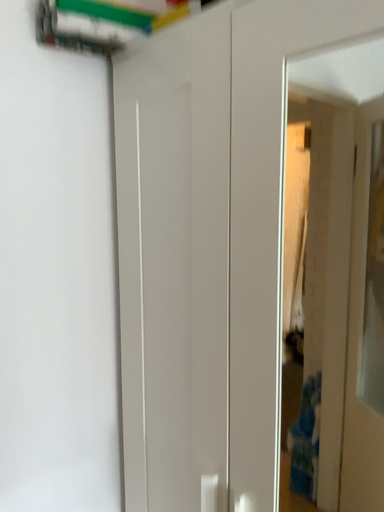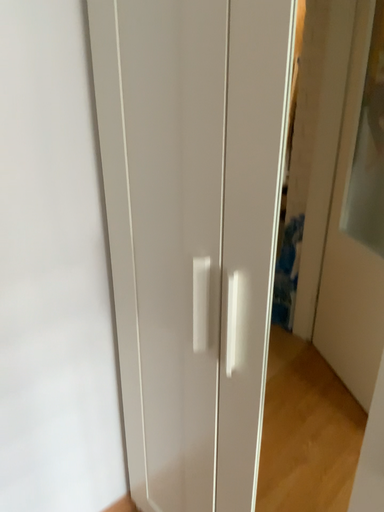
Question: How did the camera likely rotate when shooting the video?

Choices:
 (A) rotated upward
 (B) rotated downward

Answer: (B)